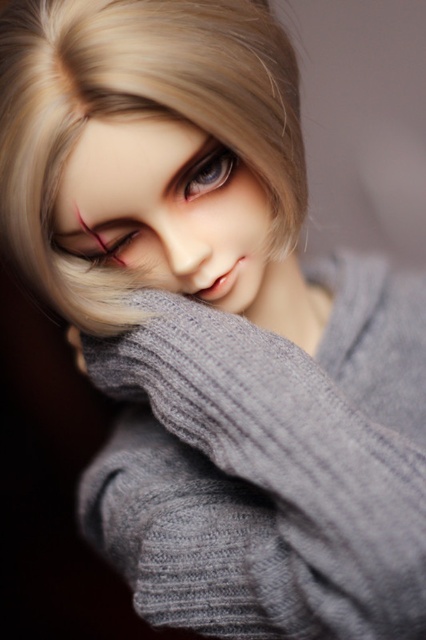
Can you confirm if matte black eye at center is bigger than matte plastic eye at center?

Yes, matte black eye at center is bigger than matte plastic eye at center.

Between point (112, 252) and point (213, 189), which one is positioned in front?

Point (213, 189) is in front.

Locate an element on the screen. matte black eye at center is located at coordinates (104, 241).

Is matte gray doll face at upper center shorter than matte plastic eye at center?

Incorrect, matte gray doll face at upper center's height does not fall short of matte plastic eye at center's.

Is point (150, 250) positioned in front of point (210, 154)?

No, it is not.

Identify the location of matte gray doll face at upper center. (166, 209).

Which is in front, point (92, 298) or point (195, 161)?

Point (195, 161) is more forward.

Can you confirm if blondehair at upper center is wider than matte plastic eye at center?

Correct, the width of blondehair at upper center exceeds that of matte plastic eye at center.

Measure the distance between point (16,154) and camera.

Point (16,154) is 18.59 inches from camera.

Locate an element on the screen. Image resolution: width=426 pixels, height=640 pixels. blondehair at upper center is located at coordinates (137, 113).